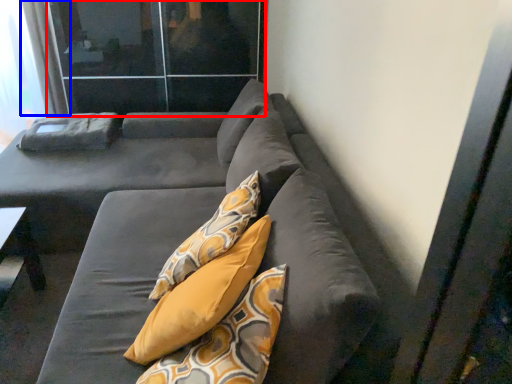
Question: Which point is closer to the camera, screen door (highlighted by a red box) or curtain (highlighted by a blue box)?

Choices:
 (A) screen door
 (B) curtain

Answer: (A)